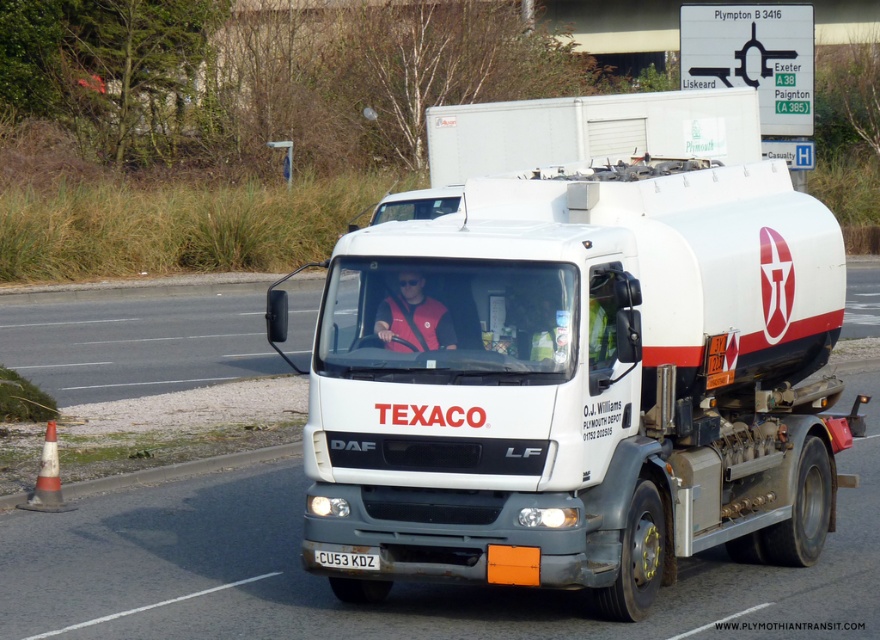
Question: Which point is closer to the camera taking this photo?

Choices:
 (A) (735, 186)
 (B) (376, 323)

Answer: (B)

Question: Which point is farther to the camera?

Choices:
 (A) red fabric vest at center
 (B) white matte tanker truck at center
 (C) white plastic license plate at center

Answer: (C)

Question: Which point is farther from the camera taking this photo?

Choices:
 (A) (361, 557)
 (B) (317, 420)

Answer: (B)

Question: Can you confirm if white matte tanker truck at center is positioned to the left of red fabric vest at center?

Choices:
 (A) no
 (B) yes

Answer: (A)

Question: Is white matte tanker truck at center wider than red fabric vest at center?

Choices:
 (A) no
 (B) yes

Answer: (B)

Question: Does red fabric vest at center have a greater width compared to white plastic license plate at center?

Choices:
 (A) no
 (B) yes

Answer: (B)